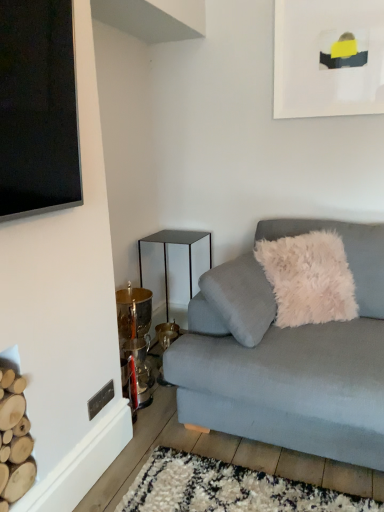
Question: Is white matte picture frame at upper right wider than metallic/glossy side table at center-left?

Choices:
 (A) no
 (B) yes

Answer: (A)

Question: Is white matte picture frame at upper right bigger than metallic/glossy side table at center-left?

Choices:
 (A) no
 (B) yes

Answer: (A)

Question: Can you confirm if white matte picture frame at upper right is thinner than metallic/glossy side table at center-left?

Choices:
 (A) yes
 (B) no

Answer: (A)

Question: Considering the relative positions of white matte picture frame at upper right and metallic/glossy side table at center-left in the image provided, is white matte picture frame at upper right to the right of metallic/glossy side table at center-left from the viewer's perspective?

Choices:
 (A) yes
 (B) no

Answer: (A)

Question: From a real-world perspective, is white matte picture frame at upper right over metallic/glossy side table at center-left?

Choices:
 (A) yes
 (B) no

Answer: (A)

Question: In terms of height, does white matte picture frame at upper right look taller or shorter compared to metallic/glossy side table at center-left?

Choices:
 (A) tall
 (B) short

Answer: (B)

Question: Which is correct: white matte picture frame at upper right is inside metallic/glossy side table at center-left, or outside of it?

Choices:
 (A) outside
 (B) inside

Answer: (A)

Question: Looking at the image, does white matte picture frame at upper right seem bigger or smaller compared to metallic/glossy side table at center-left?

Choices:
 (A) big
 (B) small

Answer: (B)

Question: Is point (304, 102) closer or farther from the camera than point (190, 272)?

Choices:
 (A) closer
 (B) farther

Answer: (A)

Question: Does point (365, 361) appear closer or farther from the camera than point (160, 233)?

Choices:
 (A) farther
 (B) closer

Answer: (B)

Question: Do you think light gray fabric couch at lower right is within metallic/glossy side table at center-left, or outside of it?

Choices:
 (A) outside
 (B) inside

Answer: (A)

Question: Considering the positions of light gray fabric couch at lower right and metallic/glossy side table at center-left in the image, is light gray fabric couch at lower right taller or shorter than metallic/glossy side table at center-left?

Choices:
 (A) short
 (B) tall

Answer: (B)

Question: Would you say light gray fabric couch at lower right is to the left or to the right of metallic/glossy side table at center-left in the picture?

Choices:
 (A) right
 (B) left

Answer: (A)

Question: Would you say light gray fabric couch at lower right is inside or outside white matte picture frame at upper right?

Choices:
 (A) inside
 (B) outside

Answer: (B)

Question: From the image's perspective, is light gray fabric couch at lower right located above or below white matte picture frame at upper right?

Choices:
 (A) above
 (B) below

Answer: (B)